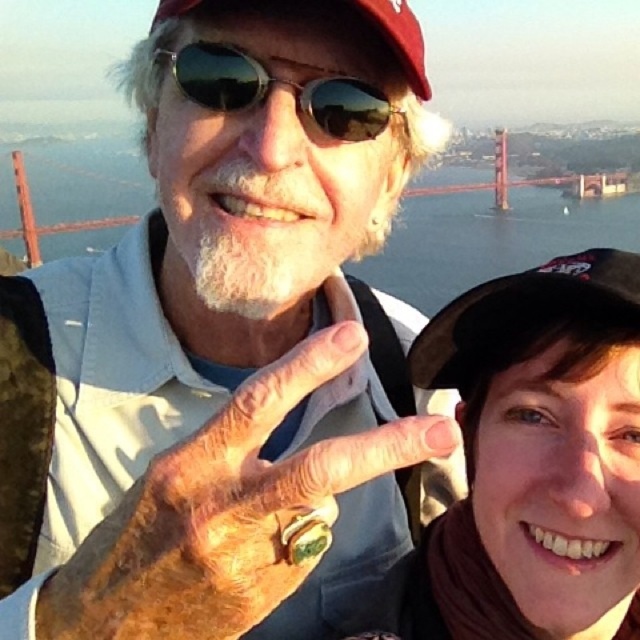
You are a photographer trying to capture a group photo of the two people in the scene. The minimum distance required between subjects for the camera to focus properly is 30 meters. Can you take the photo with the current spacing between the matte black vest at center and the other person?

The two people are 33.08 meters apart, which is more than the minimum required 30 meters. Therefore, the photographer can take the photo with the current spacing between the matte black vest at center and the other person.

You are a photographer trying to position two subjects for a group photo. You want to ensure that the subject at point (141, 512) and the subject at point (381, 0) are both visible. Based on their current positions, which subject is closer to the camera?

The subject at point (141, 512) is closer to the camera because it is in front of the subject at point (381, 0).

In the scene shown: You are a photographer trying to adjust the lighting for a photo shoot. You notice a point at coordinates (400, 36) in the image. Based on the scene description, what object is located at this point?

The point at coordinates (400, 36) corresponds to the maroon fabric baseball cap at upper center.